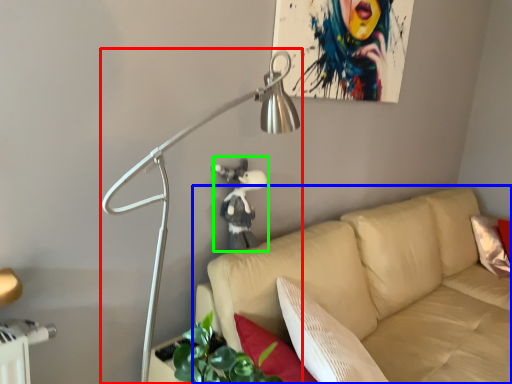
Question: Considering the real-world distances, which object is farthest from lamp (highlighted by a red box)? studio couch (highlighted by a blue box) or person (highlighted by a green box)?

Choices:
 (A) studio couch
 (B) person

Answer: (A)